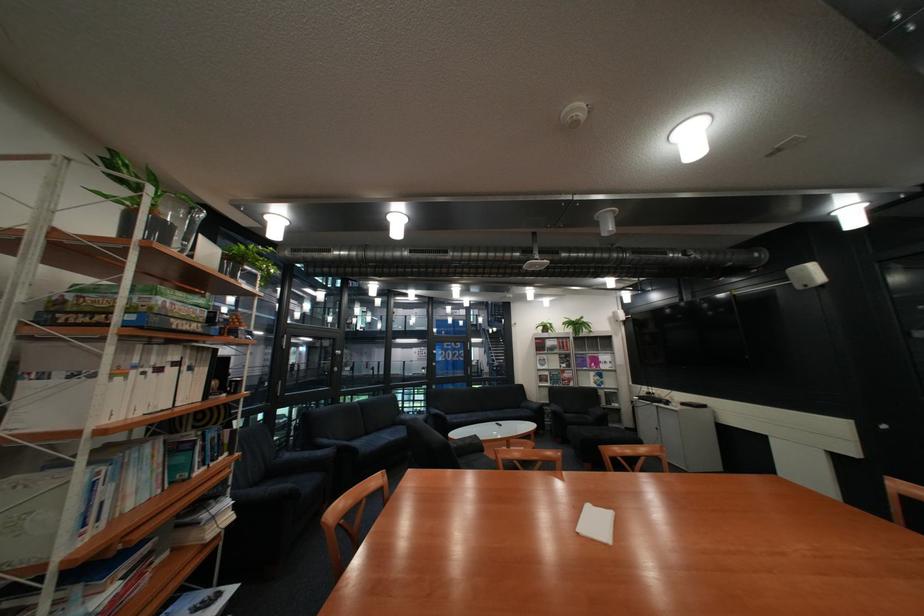
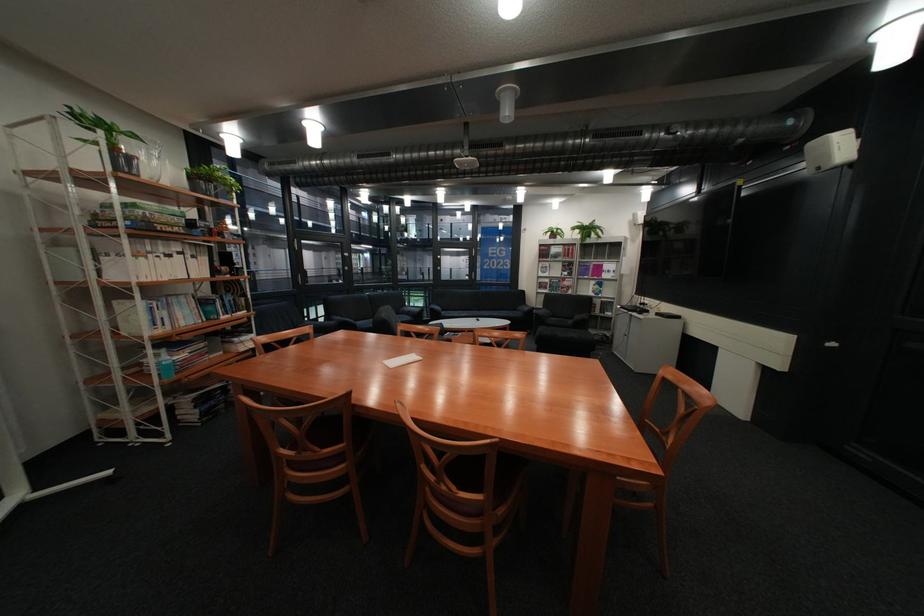
Find the pixel in the second image that matches point 582,320 in the first image.

(594, 225)